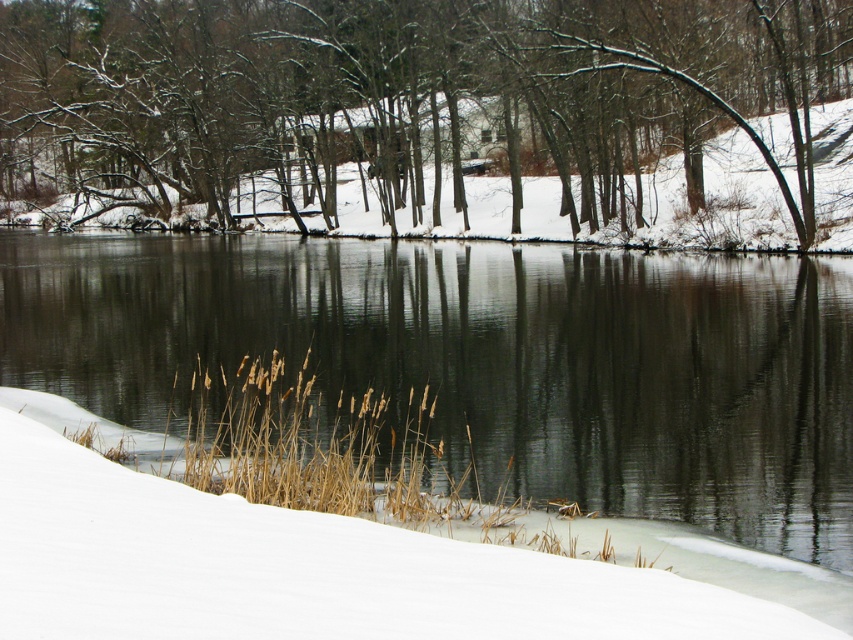
From the picture: Is clear water at center below snow-covered tree at center?

Indeed, clear water at center is positioned under snow-covered tree at center.

Does point (828, 472) come in front of point (91, 29)?

Yes, it is in front of point (91, 29).

Identify the location of clear water at center. (485, 360).

Is point (685, 17) closer to camera compared to point (399, 627)?

No.

Who is more forward, (125,150) or (33,468)?

Positioned in front is point (33,468).

I want to click on snow-covered tree at center, so click(x=405, y=92).

Looking at this image, does clear water at center appear over white fluffy snow at lower center?

Yes, clear water at center is above white fluffy snow at lower center.

Based on the photo, who is positioned more to the right, clear water at center or white fluffy snow at lower center?

Positioned to the right is clear water at center.

Is point (769, 477) closer to viewer compared to point (486, 620)?

No, (769, 477) is further to viewer.

The width and height of the screenshot is (853, 640). Identify the location of clear water at center. (485, 360).